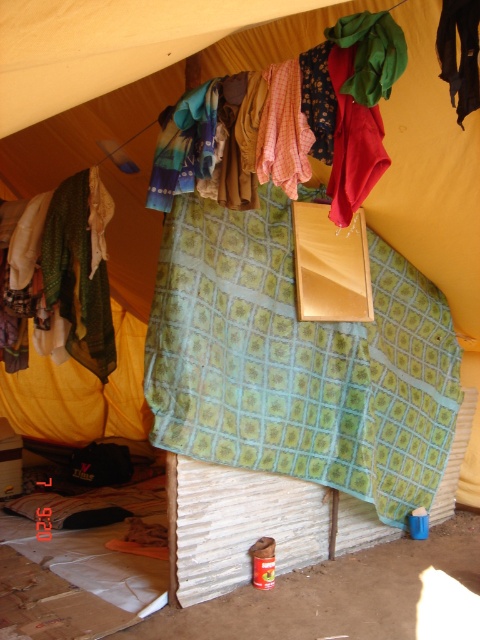
Question: Estimate the real-world distances between objects in this image. Which object is closer to the multicolored fabric at upper center?

Choices:
 (A) red cotton cloth at center
 (B) green fabric at left

Answer: (A)

Question: Which of these objects is positioned closest to the multicolored fabric at upper center?

Choices:
 (A) red cotton cloth at center
 (B) green patterned fabric at center

Answer: (A)

Question: Is the position of green patterned fabric at center more distant than that of green fabric at left?

Choices:
 (A) yes
 (B) no

Answer: (B)

Question: Based on their relative distances, which object is farther from the green patterned fabric at center?

Choices:
 (A) green fabric at left
 (B) multicolored fabric at upper center
 (C) red cotton cloth at center

Answer: (C)

Question: Can you confirm if green patterned fabric at center is positioned below green fabric at left?

Choices:
 (A) no
 (B) yes

Answer: (B)

Question: Can you confirm if multicolored fabric at upper center is wider than green fabric at left?

Choices:
 (A) no
 (B) yes

Answer: (B)